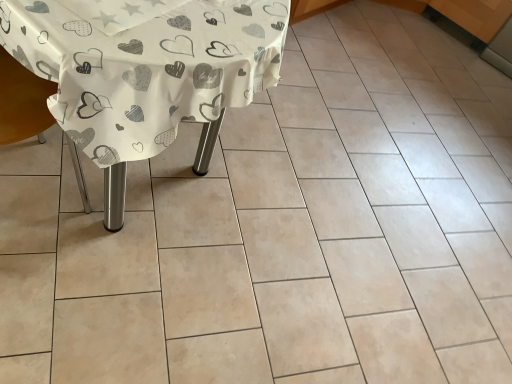
Question: Can you confirm if white paper with heart patterns at center is wider than wooden armchair at left?

Choices:
 (A) no
 (B) yes

Answer: (B)

Question: From a real-world perspective, is white paper with heart patterns at center physically above wooden armchair at left?

Choices:
 (A) no
 (B) yes

Answer: (B)

Question: From a real-world perspective, is white paper with heart patterns at center under wooden armchair at left?

Choices:
 (A) yes
 (B) no

Answer: (B)

Question: Is white paper with heart patterns at center not near wooden armchair at left?

Choices:
 (A) yes
 (B) no

Answer: (B)

Question: Does white paper with heart patterns at center come behind wooden armchair at left?

Choices:
 (A) yes
 (B) no

Answer: (A)

Question: Does white paper with heart patterns at center appear on the left side of wooden armchair at left?

Choices:
 (A) no
 (B) yes

Answer: (A)

Question: Does wooden armchair at left lie in front of white paper with heart patterns at center?

Choices:
 (A) yes
 (B) no

Answer: (A)

Question: Is wooden armchair at left not within white paper with heart patterns at center?

Choices:
 (A) no
 (B) yes

Answer: (B)

Question: Is the position of wooden armchair at left more distant than that of white paper with heart patterns at center?

Choices:
 (A) no
 (B) yes

Answer: (A)

Question: Could white paper with heart patterns at center be considered to be inside wooden armchair at left?

Choices:
 (A) yes
 (B) no

Answer: (B)

Question: From the image's perspective, is wooden armchair at left above white paper with heart patterns at center?

Choices:
 (A) yes
 (B) no

Answer: (B)

Question: From a real-world perspective, is wooden armchair at left beneath white paper with heart patterns at center?

Choices:
 (A) no
 (B) yes

Answer: (B)

Question: In terms of width, does white paper with heart patterns at center look wider or thinner when compared to wooden armchair at left?

Choices:
 (A) wide
 (B) thin

Answer: (A)